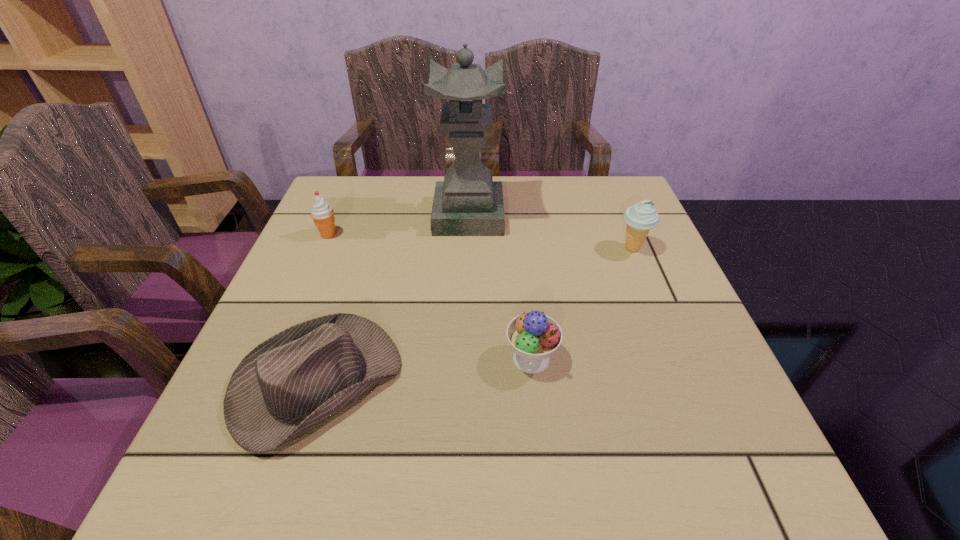
Find the location of a particular element. object present at the far edge is located at coordinates (468, 202).

Locate an element on the screen. The image size is (960, 540). object at the near edge is located at coordinates (289, 384).

Locate an element on the screen. This screenshot has width=960, height=540. icecream that is at the left edge is located at coordinates (322, 213).

Where is `fedora at the left edge`? The image size is (960, 540). fedora at the left edge is located at coordinates click(289, 384).

Identify the location of object that is at the right edge. (640, 218).

This screenshot has width=960, height=540. Find the location of `object that is at the near left corner`. object that is at the near left corner is located at coordinates (289, 384).

Locate an element on the screen. This screenshot has height=540, width=960. vacant space at the far edge of the desktop is located at coordinates click(522, 184).

Locate an element on the screen. free space at the left edge is located at coordinates (366, 230).

In the image, there is a desktop. Identify the location of vacant space at the right edge. The height and width of the screenshot is (540, 960). (613, 249).

This screenshot has height=540, width=960. In order to click on free spot at the far left corner of the desktop in this screenshot , I will do `click(338, 202)`.